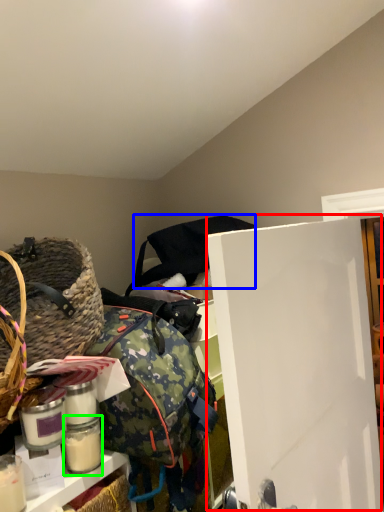
Question: Based on their relative distances, which object is nearer to door (highlighted by a red box)? Choose from bag (highlighted by a blue box) and glass jar (highlighted by a green box).

Choices:
 (A) bag
 (B) glass jar

Answer: (A)